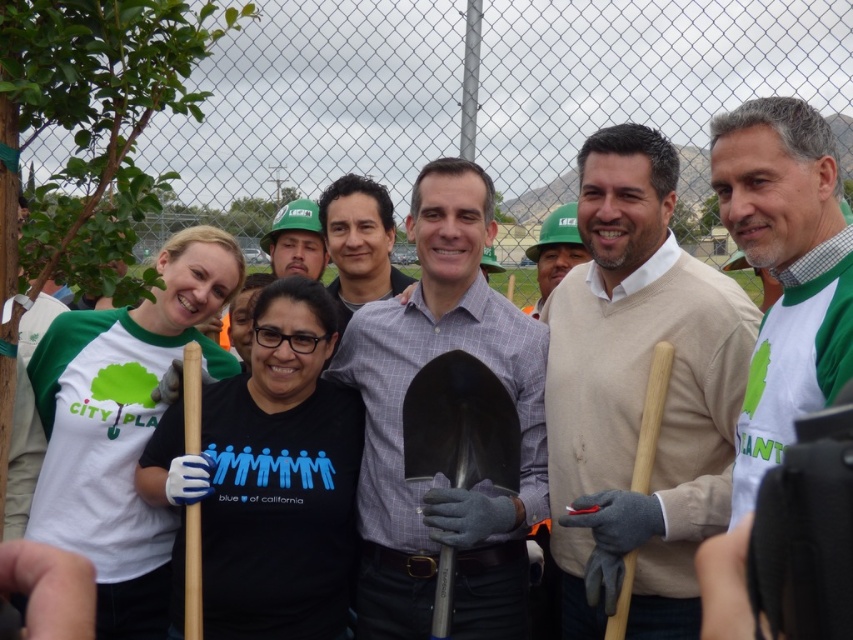
From the picture: You are a photographer trying to capture a photo of the beige sweater at center and the wooden shovel at right. The camera can only focus on objects above 1.5 meters in height. Will both objects be in focus?

The beige sweater at center has a greater height compared to wooden shovel at right. Since the beige sweater at center is taller than the shovel, if the sweater is above 1.5 meters, it will be in focus. However, the wooden shovel at right might be shorter than 1.5 meters and thus out of focus. The answer depends on the exact height of each object, but based on the given information, only the beige sweater at center is confirmed to meet the height requirement.